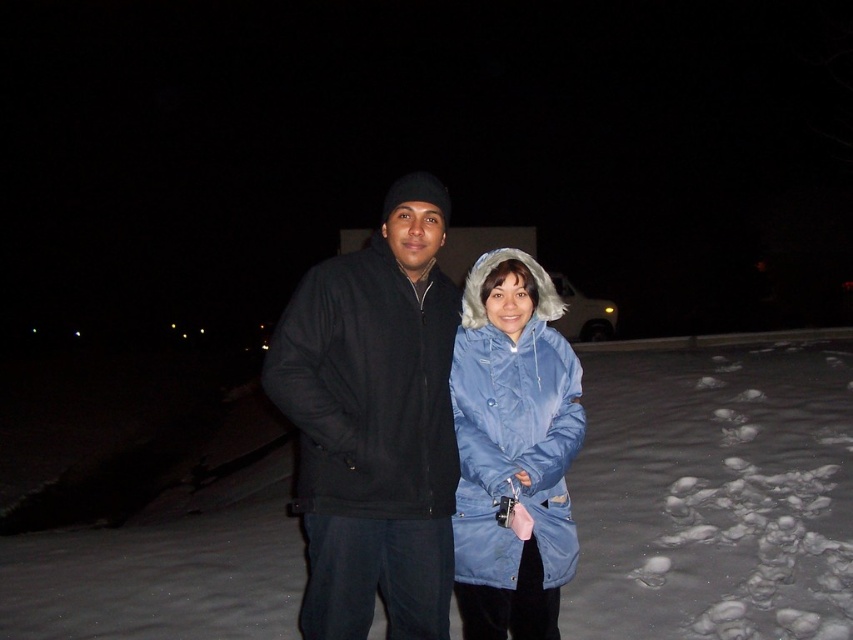
Can you confirm if white fluffy snow at center is positioned to the left of blue matte coat at center?

No, white fluffy snow at center is not to the left of blue matte coat at center.

Measure the distance between white fluffy snow at center and camera.

white fluffy snow at center is 11.91 feet from camera.

I want to click on white fluffy snow at center, so click(x=714, y=492).

Between matte black jacket at center and blue matte coat at center, which one has more height?

Standing taller between the two is matte black jacket at center.

In the scene shown: Does matte black jacket at center have a greater width compared to blue matte coat at center?

Correct, the width of matte black jacket at center exceeds that of blue matte coat at center.

This screenshot has height=640, width=853. Identify the location of matte black jacket at center. (374, 422).

This screenshot has width=853, height=640. I want to click on matte black jacket at center, so click(x=374, y=422).

In the scene shown: Between white fluffy snow at center and matte black jacket at center, which one is positioned higher?

matte black jacket at center

Is white fluffy snow at center thinner than matte black jacket at center?

In fact, white fluffy snow at center might be wider than matte black jacket at center.

Between point (694, 612) and point (344, 392), which one is positioned in front?

Point (344, 392) is in front.

The height and width of the screenshot is (640, 853). Identify the location of white fluffy snow at center. (714, 492).